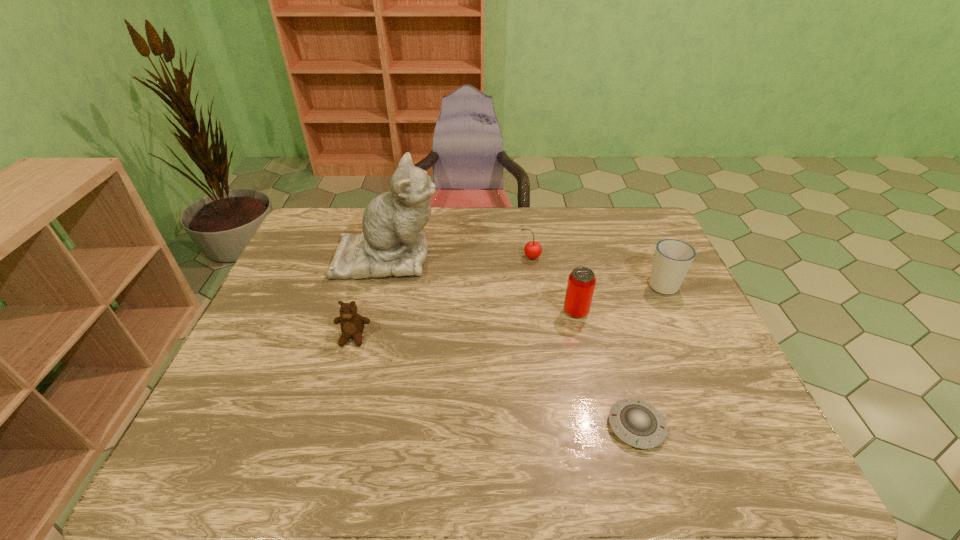
The image size is (960, 540). I want to click on free spot between the second nearest object and the saucer, so click(x=494, y=382).

Where is `free spot between the cat and the teddy bear`? The width and height of the screenshot is (960, 540). free spot between the cat and the teddy bear is located at coordinates (371, 297).

Where is `empty space between the cat and the fourth object from right to left`? This screenshot has height=540, width=960. empty space between the cat and the fourth object from right to left is located at coordinates (459, 257).

Locate an element on the screen. The image size is (960, 540). free space between the third nearest object and the nearest object is located at coordinates pos(606,369).

This screenshot has height=540, width=960. What are the coordinates of `vacant space that is in between the tallest object and the saucer` in the screenshot? It's located at (512, 341).

You are a GUI agent. You are given a task and a screenshot of the screen. Output one action in this format:
    pyautogui.click(x=<x>, y=<y>)
    Task: Click on the free space between the teddy bear and the tallest object
    The image size is (960, 540).
    Given the screenshot: What is the action you would take?
    pyautogui.click(x=371, y=297)

You are a GUI agent. You are given a task and a screenshot of the screen. Output one action in this format:
    pyautogui.click(x=<x>, y=<y>)
    Task: Click on the free point between the cat and the third object from left to right
    This screenshot has height=540, width=960.
    Given the screenshot: What is the action you would take?
    pyautogui.click(x=459, y=257)

The height and width of the screenshot is (540, 960). Identify the location of object that stands as the second closest to the cup. (533, 249).

Find the location of `object that is the third closest one to the third object from left to right`. object that is the third closest one to the third object from left to right is located at coordinates 672,259.

The width and height of the screenshot is (960, 540). In order to click on free space that satisfies the following two spatial constraints: 1. at the face of the fifth farthest object; 2. on the left side of the nearest object in this screenshot , I will do click(x=328, y=426).